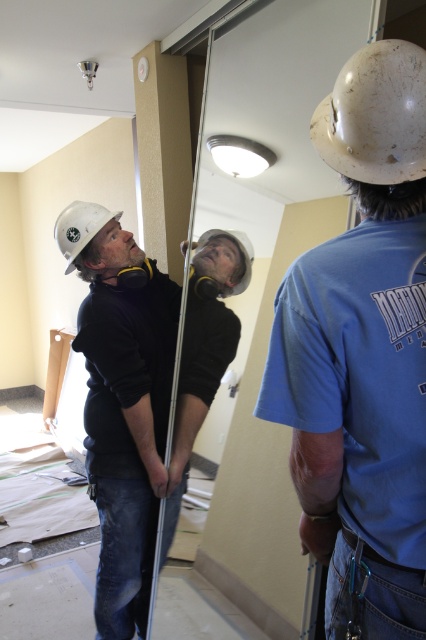
Question: Does white matte hard hat at upper right have a lesser width compared to white matte helmet at upper left?

Choices:
 (A) yes
 (B) no

Answer: (B)

Question: Does white matte hard hat at upper right lie behind white matte hard hat at upper center?

Choices:
 (A) yes
 (B) no

Answer: (A)

Question: Which of the following is the farthest from the observer?

Choices:
 (A) (141, 484)
 (B) (414, 310)
 (C) (235, 236)
 (D) (402, 173)

Answer: (A)

Question: Is white matte hard hat at upper right to the right of white matte helmet at upper left from the viewer's perspective?

Choices:
 (A) no
 (B) yes

Answer: (B)

Question: Which point is farther to the camera?

Choices:
 (A) (86, 205)
 (B) (333, 115)
 (C) (386, 524)
 (D) (233, 288)

Answer: (D)

Question: Which of the following is the farthest from the observer?

Choices:
 (A) white hard hat at upper center
 (B) white matte helmet at upper left

Answer: (A)